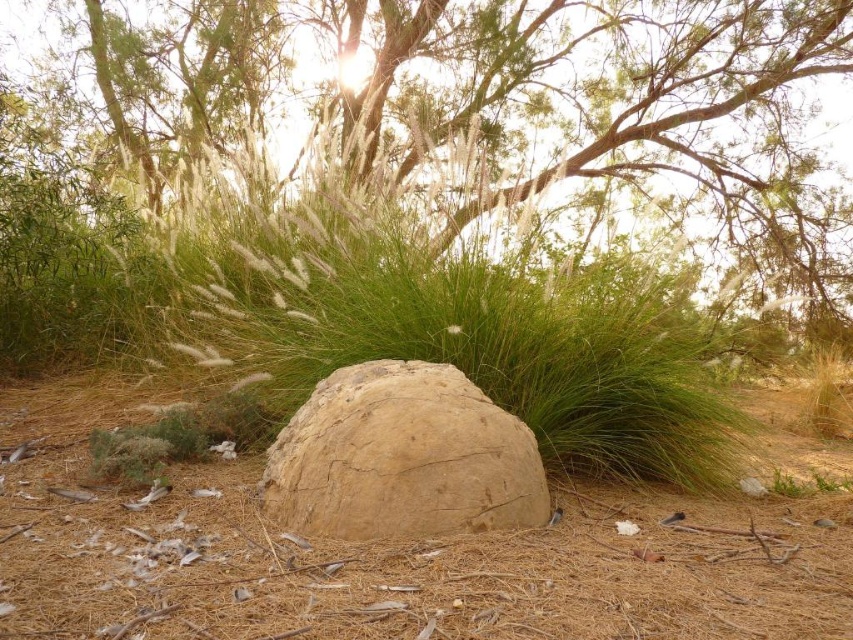
You are standing at the base of the green leafy tree at upper center and want to walk to the green grass at center. How far will you have to walk?

The green leafy tree at upper center is 5.87 meters from the green grass at center, so you will have to walk 5.87 meters to reach the green grass at center.

You are standing in the middle of the dry landscape and want to reach the brown rough boulder at center. Do you need to step over the green grass at center to get there?

The brown rough boulder at center is behind the green grass at center, so yes, you would need to step over the green grass at center to reach the brown rough boulder at center.

You are standing in the dry landscape looking at the large rock. There are two points marked on the rock surface at coordinates point (132, 68) and point (166, 301). Which point is closer to you?

Point (132, 68) is further to the camera than point (166, 301), so the point closer to you is point (166, 301).